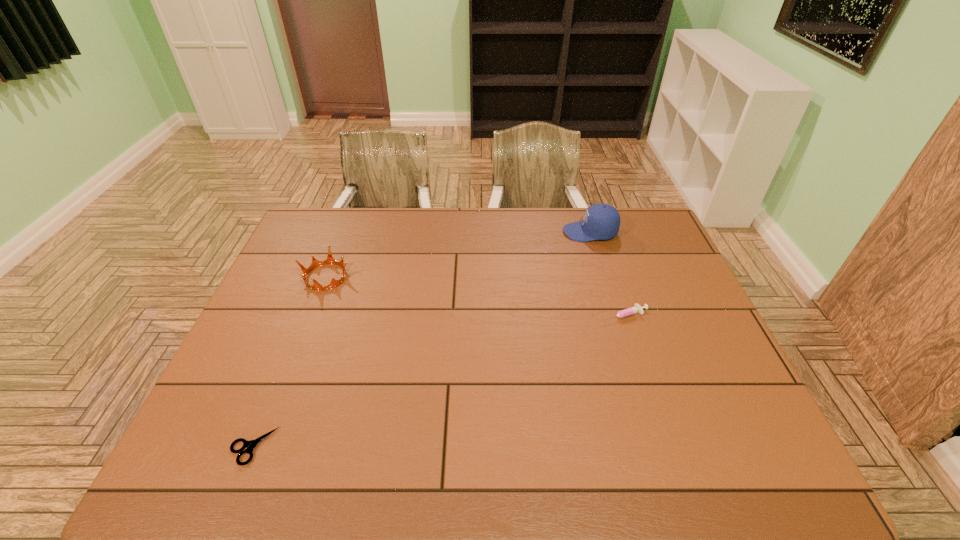
Find the location of a particular element. The image size is (960, 540). vacant position in the image that satisfies the following two spatial constraints: 1. on the back side of the crown; 2. on the right side of the shortest object is located at coordinates (321, 277).

This screenshot has width=960, height=540. Identify the location of vacant region that satisfies the following two spatial constraints: 1. on the front-facing side of the tallest object; 2. on the front side of the shears. click(657, 447).

At what (x,y) coordinates should I click in order to perform the action: click on vacant space that satisfies the following two spatial constraints: 1. on the front-facing side of the third tallest object; 2. on the left side of the tallest object. Please return your answer as a coordinate pair (x, y). The height and width of the screenshot is (540, 960). Looking at the image, I should click on (615, 315).